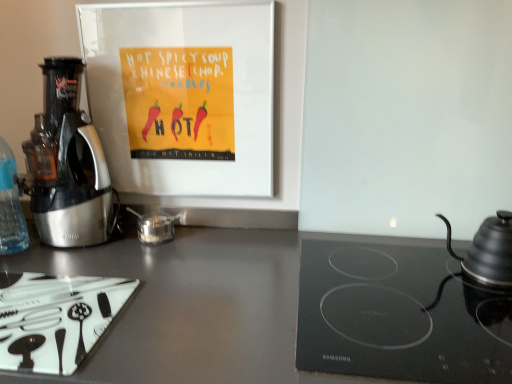
Where is `free space in front of transparent glass tea pot at center`? The height and width of the screenshot is (384, 512). free space in front of transparent glass tea pot at center is located at coordinates (155, 260).